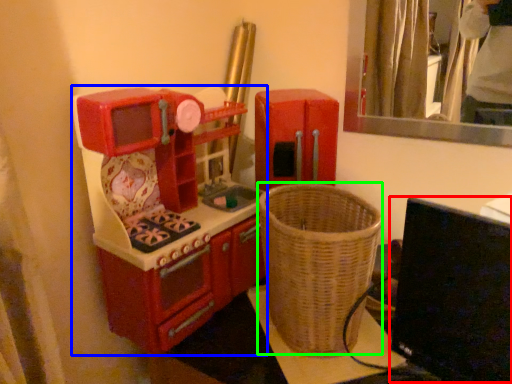
Question: Which is nearer to the computer monitor (highlighted by a red box)? appliance (highlighted by a blue box) or basket (highlighted by a green box).

Choices:
 (A) appliance
 (B) basket

Answer: (B)